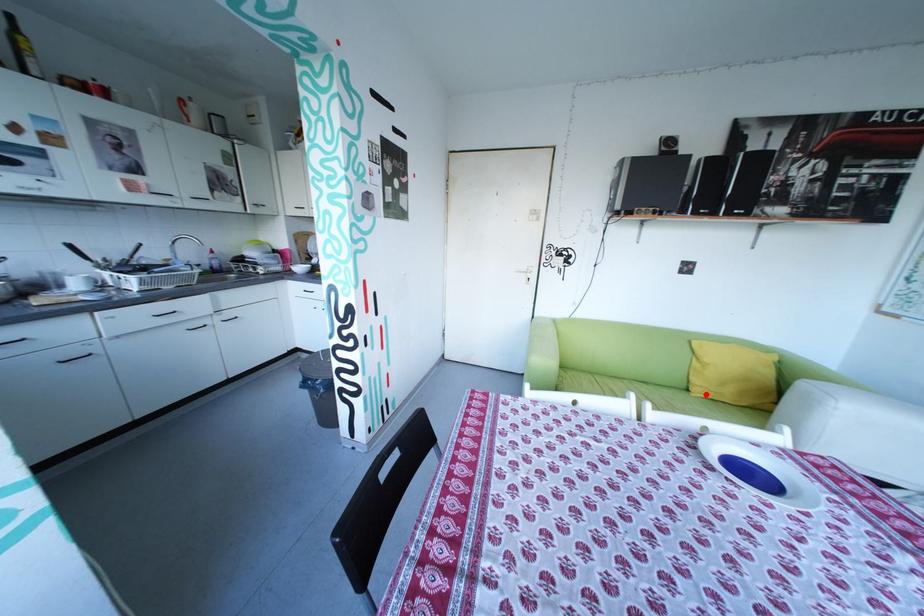
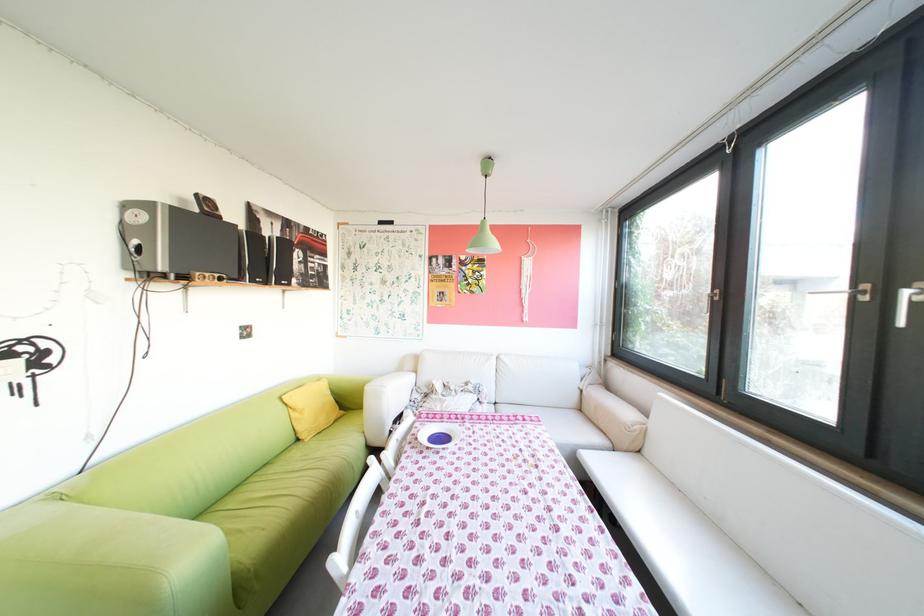
Locate, in the second image, the point that corresponds to the highlighted location in the first image.

(321, 440)